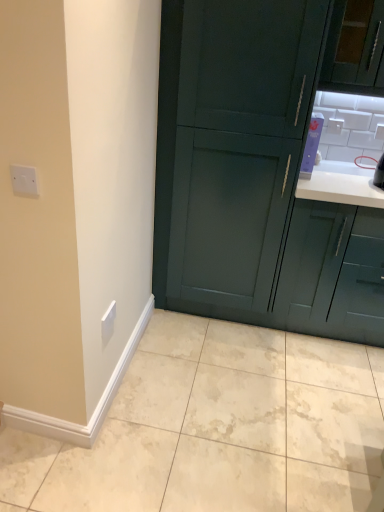
Question: Does matte teal cabinet at upper right, the second cabinetry in the left-to-right sequence, come behind beige marble tile at lower center?

Choices:
 (A) yes
 (B) no

Answer: (A)

Question: From a real-world perspective, is matte teal cabinet at upper right, the second cabinetry in the left-to-right sequence, physically below beige marble tile at lower center?

Choices:
 (A) yes
 (B) no

Answer: (B)

Question: Is matte teal cabinet at upper right, which ranks as the 1th cabinetry in right-to-left order, facing towards beige marble tile at lower center?

Choices:
 (A) yes
 (B) no

Answer: (B)

Question: Is matte teal cabinet at upper right, the second cabinetry in the left-to-right sequence, in front of beige marble tile at lower center?

Choices:
 (A) yes
 (B) no

Answer: (B)

Question: Is matte teal cabinet at upper right, the second cabinetry in the left-to-right sequence, positioned with its back to beige marble tile at lower center?

Choices:
 (A) no
 (B) yes

Answer: (A)

Question: From the image's perspective, is matte teal cabinet at upper right, which ranks as the 1th cabinetry in right-to-left order, above beige marble tile at lower center?

Choices:
 (A) no
 (B) yes

Answer: (B)

Question: Can you confirm if matte teal cabinet at upper right, the second cabinetry in the left-to-right sequence, is smaller than white glossy electric outlet at upper center, which is counted as the 3th electric outlet, starting from the left?

Choices:
 (A) yes
 (B) no

Answer: (B)

Question: Is matte teal cabinet at upper right, which ranks as the 1th cabinetry in right-to-left order, touching white glossy electric outlet at upper center, the fourth electric outlet from the front?

Choices:
 (A) no
 (B) yes

Answer: (A)

Question: Is matte teal cabinet at upper right, which ranks as the 1th cabinetry in right-to-left order, thinner than white glossy electric outlet at upper center, which is the second electric outlet from right to left?

Choices:
 (A) no
 (B) yes

Answer: (A)

Question: Could you tell me if matte teal cabinet at upper right, which ranks as the 1th cabinetry in right-to-left order, is facing white glossy electric outlet at upper center, the fourth electric outlet from the front?

Choices:
 (A) yes
 (B) no

Answer: (B)

Question: From the image's perspective, would you say matte teal cabinet at upper right, which ranks as the 1th cabinetry in right-to-left order, is shown under white glossy electric outlet at upper center, marked as the fourth electric outlet in a bottom-to-top arrangement?

Choices:
 (A) yes
 (B) no

Answer: (A)

Question: Does matte teal cabinet at upper right, the second cabinetry in the left-to-right sequence, lie behind white glossy electric outlet at upper center, the fourth electric outlet from the front?

Choices:
 (A) yes
 (B) no

Answer: (B)

Question: Is beige marble tile at lower center surrounded by dark green wood cabinet at center, placed as the 2th cabinetry when sorted from right to left?

Choices:
 (A) yes
 (B) no

Answer: (B)